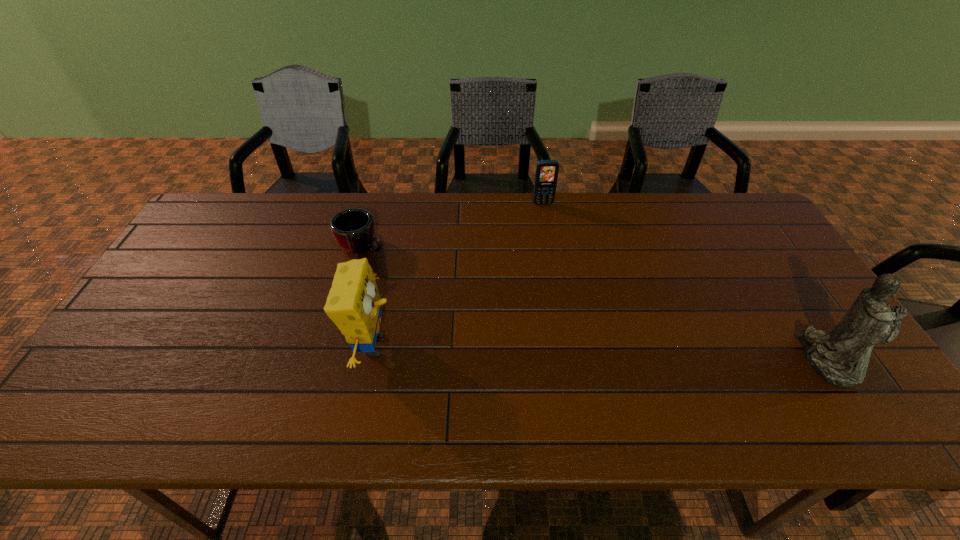
Find the location of a particular element. The height and width of the screenshot is (540, 960). free space located on the side of the third nearest object with the handle is located at coordinates (446, 288).

You are a GUI agent. You are given a task and a screenshot of the screen. Output one action in this format:
    pyautogui.click(x=<x>, y=<y>)
    Task: Click on the blank space located 0.300m on the screen of the second shortest object
    
    Given the screenshot: What is the action you would take?
    pyautogui.click(x=561, y=268)

Identify the location of free spot located on the screen of the second shortest object. The width and height of the screenshot is (960, 540). (549, 225).

This screenshot has width=960, height=540. Identify the location of vacant space situated 0.260m on the screen of the second shortest object. point(558,259).

The image size is (960, 540). Identify the location of mug situated at the far edge. (353, 229).

At what (x,y) coordinates should I click in order to perform the action: click on cellular telephone present at the far edge. Please return your answer as a coordinate pair (x, y). The width and height of the screenshot is (960, 540). Looking at the image, I should click on (546, 175).

Find the location of a particular element. sponge at the near edge is located at coordinates (354, 305).

The image size is (960, 540). What are the coordinates of `figurine that is at the near edge` in the screenshot? It's located at (841, 357).

This screenshot has height=540, width=960. Find the location of `object at the right edge`. object at the right edge is located at coordinates (841, 357).

Identify the location of object positioned at the near right corner. The height and width of the screenshot is (540, 960). (841, 357).